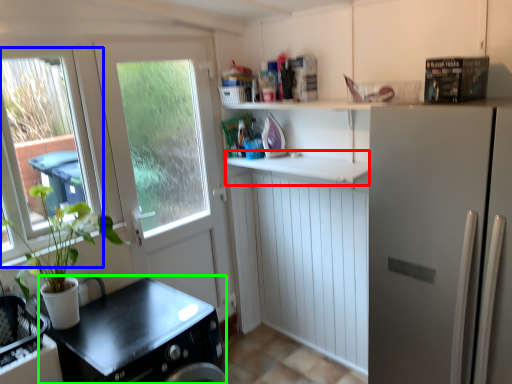
Question: Estimate the real-world distances between objects in this image. Which object is farther from counter top (highlighted by a red box), window (highlighted by a blue box) or counter top (highlighted by a green box)?

Choices:
 (A) window
 (B) counter top

Answer: (A)